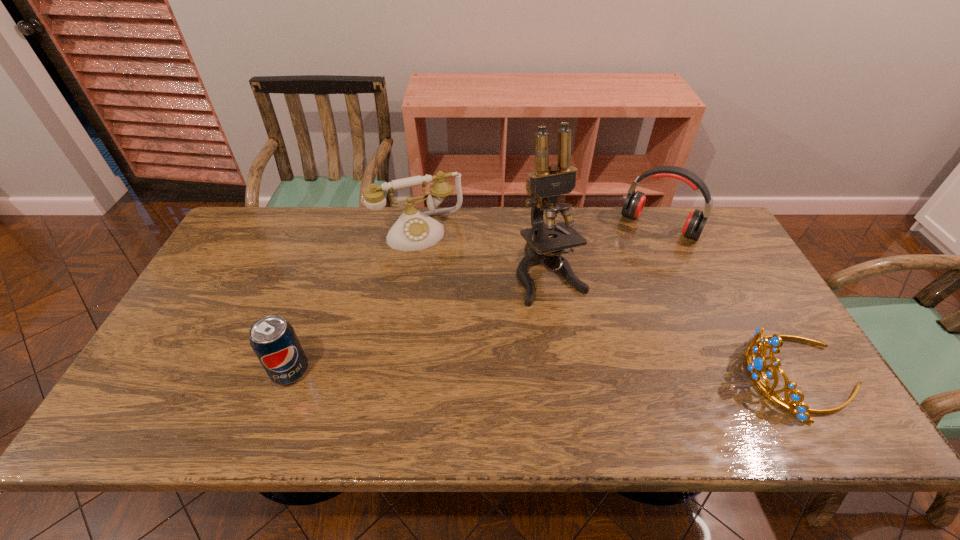
This screenshot has height=540, width=960. Identify the location of free region at the right edge of the desktop. (714, 258).

The height and width of the screenshot is (540, 960). In the image, there is a desktop. What are the coordinates of `vacant space at the far left corner` in the screenshot? It's located at (253, 230).

Identify the location of vacant space at the near left corner. The image size is (960, 540). (210, 372).

You are a GUI agent. You are given a task and a screenshot of the screen. Output one action in this format:
    pyautogui.click(x=<x>, y=<y>)
    Task: Click on the free space that is in between the tallest object and the tiara
    The width and height of the screenshot is (960, 540).
    Given the screenshot: What is the action you would take?
    pyautogui.click(x=675, y=326)

This screenshot has height=540, width=960. I want to click on free point between the second object from left to right and the tiara, so click(x=609, y=304).

At what (x,y) coordinates should I click in order to perform the action: click on vacant space in between the soda can and the tiara. Please return your answer as a coordinate pair (x, y). Looking at the image, I should click on (544, 374).

Where is `free space between the tallest object and the earphone`? This screenshot has width=960, height=540. free space between the tallest object and the earphone is located at coordinates (605, 250).

I want to click on free space between the second object from left to right and the tallest object, so click(485, 253).

Image resolution: width=960 pixels, height=540 pixels. I want to click on free space between the tiara and the second object from left to right, so 609,304.

Identify the location of free space that is in between the tiara and the second object from left to right. Image resolution: width=960 pixels, height=540 pixels. (609, 304).